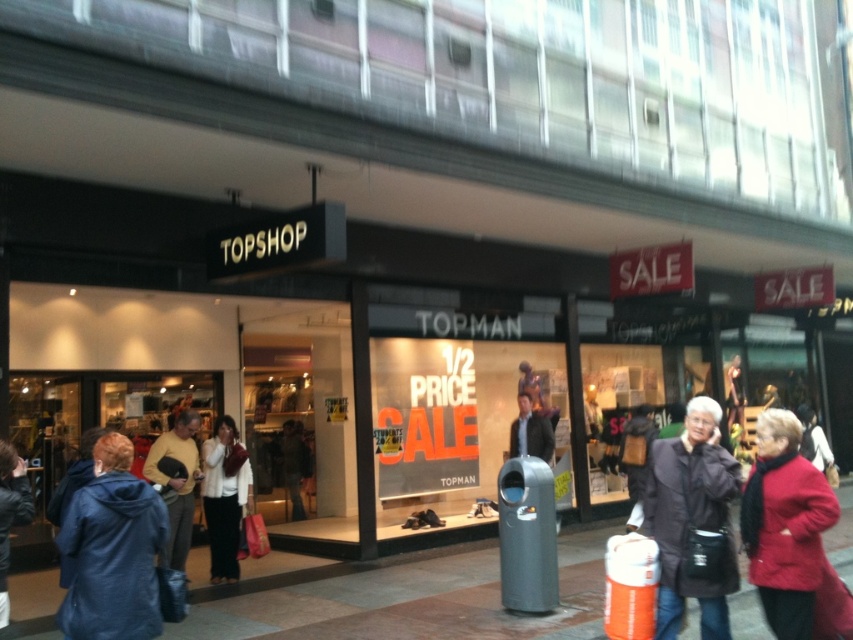
Is dark brown leather jacket at lower right to the right of dark blue jacket at lower left from the viewer's perspective?

Yes, dark brown leather jacket at lower right is to the right of dark blue jacket at lower left.

Does point (643, 508) lie in front of point (1, 516)?

That is False.

Does point (676, 465) come closer to viewer compared to point (22, 500)?

No, it is behind (22, 500).

Locate an element on the screen. Image resolution: width=853 pixels, height=640 pixels. dark brown leather jacket at lower right is located at coordinates (691, 516).

Between point (489, 605) and point (25, 493), which one is positioned behind?

Positioned behind is point (489, 605).

Where is `concrete pavement at center`? This screenshot has width=853, height=640. concrete pavement at center is located at coordinates (402, 600).

Can you confirm if blue hooded jacket at lower left is smaller than yellow sweater at center?

No, blue hooded jacket at lower left is not smaller than yellow sweater at center.

Can you confirm if blue hooded jacket at lower left is bigger than yellow sweater at center?

Yes, blue hooded jacket at lower left is bigger than yellow sweater at center.

You are a GUI agent. You are given a task and a screenshot of the screen. Output one action in this format:
    pyautogui.click(x=<x>, y=<y>)
    Task: Click on the blue hooded jacket at lower left
    
    Given the screenshot: What is the action you would take?
    111,550

At what (x,y) coordinates should I click in order to perform the action: click on blue hooded jacket at lower left. Please return your answer as a coordinate pair (x, y). The image size is (853, 640). Looking at the image, I should click on [x=111, y=550].